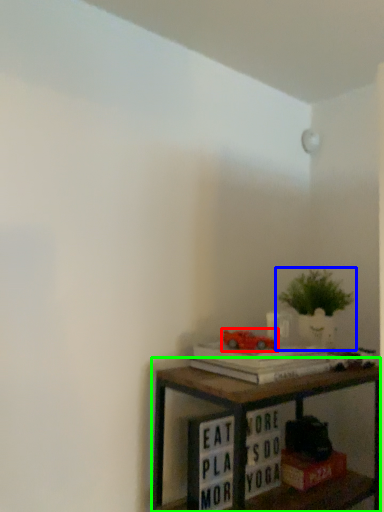
Question: Based on their relative distances, which object is nearer to toy (highlighted by a red box)? Choose from houseplant (highlighted by a blue box) and shelf (highlighted by a green box).

Choices:
 (A) houseplant
 (B) shelf

Answer: (B)